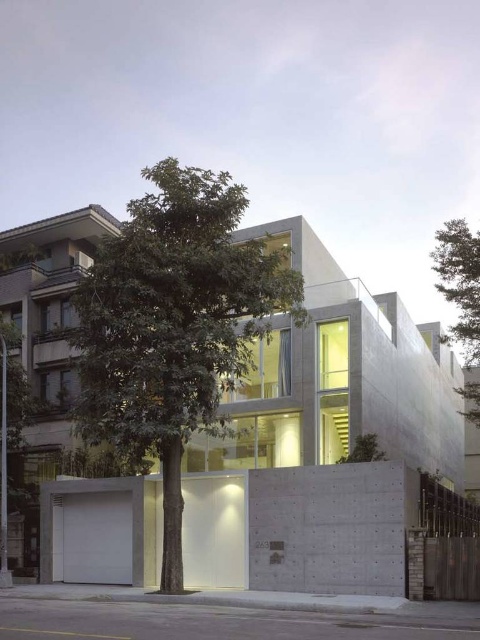
Which is below, green leafy tree at center or green leafy tree at upper right?

green leafy tree at center

Does point (276, 285) come in front of point (474, 266)?

Yes.

Which is in front, point (298, 321) or point (456, 339)?

Point (298, 321) is more forward.

At what (x,y) coordinates should I click in order to perform the action: click on green leafy tree at center. Please return your answer as a coordinate pair (x, y). The image size is (480, 640). Looking at the image, I should click on (173, 324).